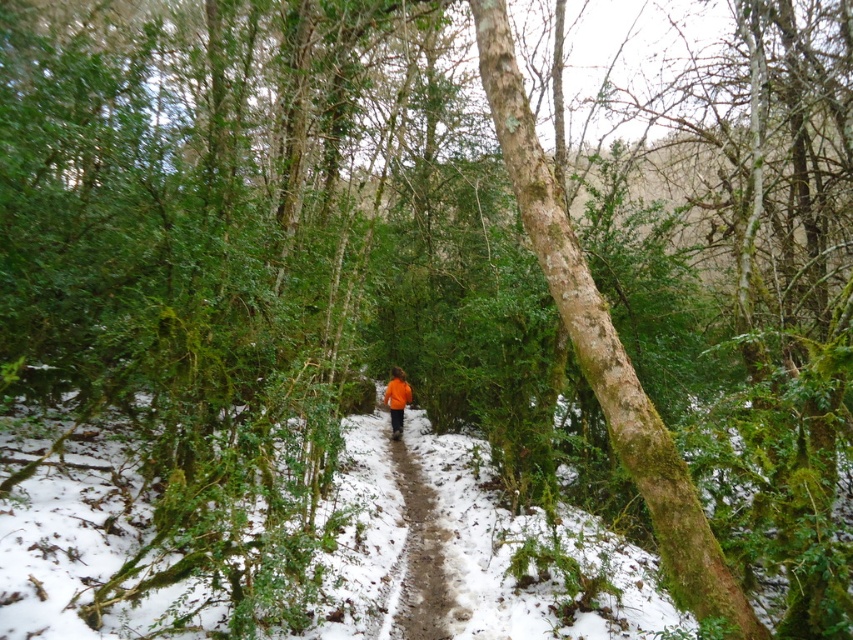
Can you confirm if orange fabric at center is positioned to the left of orange fabric jacket at center?

No, orange fabric at center is not to the left of orange fabric jacket at center.

Is point (392, 378) farther from viewer compared to point (401, 413)?

That is False.

Image resolution: width=853 pixels, height=640 pixels. I want to click on orange fabric at center, so click(x=419, y=552).

Which is behind, point (543, 212) or point (403, 380)?

Point (403, 380)

Which is in front, point (612, 428) or point (401, 387)?

Positioned in front is point (612, 428).

Find the location of `green mossy bark tree at center`. green mossy bark tree at center is located at coordinates (605, 348).

Between green mossy bark tree at center and orange fabric at center, which one is positioned lower?

orange fabric at center

Can you confirm if green mossy bark tree at center is bigger than orange fabric at center?

Yes.

Is point (494, 76) farther from camera compared to point (431, 525)?

That is False.

At what (x,y) coordinates should I click in order to perform the action: click on green mossy bark tree at center. Please return your answer as a coordinate pair (x, y). This screenshot has height=640, width=853. Looking at the image, I should click on pos(605,348).